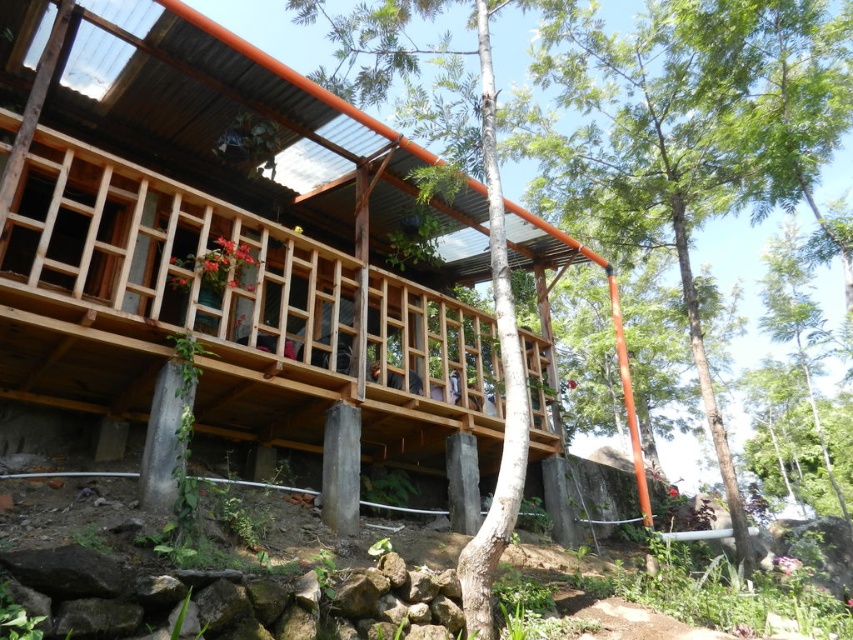
In the scene shown: You are standing in front of the wooden structure on stilts. You notice a wooden deck at center and a green leafy tree at center. Which one is closer to you?

The wooden deck at center is closer to the viewer than the green leafy tree at center.

You are standing at the entrance of the wooden structure and want to reach the wooden deck at center. According to the coordinates provided, in which direction should you move relative to your current position?

The wooden deck at center is located at coordinates 0.487 on the x axis and 0.259 on the y axis. Since you are at the entrance, which is likely positioned at the front of the structure, you should move towards the center of the structure to reach the wooden deck at center.